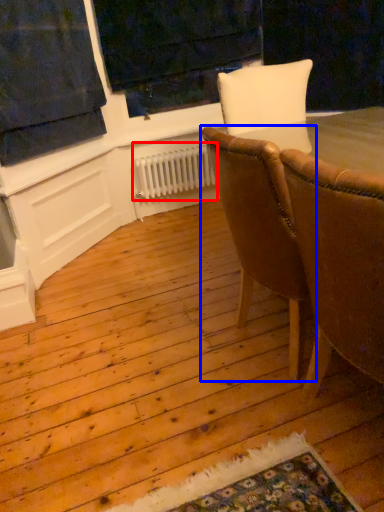
Question: Which of the following is the closest to the observer, radiator (highlighted by a red box) or chair (highlighted by a blue box)?

Choices:
 (A) radiator
 (B) chair

Answer: (B)